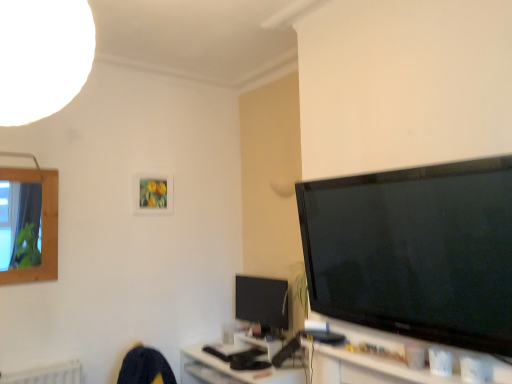
Find the location of a particular element. matte wooden picture frame at upper center is located at coordinates (152, 194).

In order to face matte wooden picture frame at upper center, should I rotate leftwards or rightwards?

Rotate left and turn 13.158 degrees.

The image size is (512, 384). I want to click on wooden frame at left, so click(42, 226).

What is the approximate width of matte black monitor at center?

The width of matte black monitor at center is 3.24 inches.

What do you see at coordinates (234, 370) in the screenshot?
I see `black matte keyboard at lower center` at bounding box center [234, 370].

You are a GUI agent. You are given a task and a screenshot of the screen. Output one action in this format:
    pyautogui.click(x=<x>, y=<y>)
    Task: Click on the white glossy tv cabinet at lower right
    
    Given the screenshot: What is the action you would take?
    pyautogui.click(x=400, y=361)

Where is `tv cabinet above the black matte keyboard at lower center (from the image's perspective)`? tv cabinet above the black matte keyboard at lower center (from the image's perspective) is located at coordinates (400, 361).

Which is in front, white glossy tv cabinet at lower right or black matte keyboard at lower center?

white glossy tv cabinet at lower right.

Considering the sizes of white glossy tv cabinet at lower right and black matte keyboard at lower center in the image, is white glossy tv cabinet at lower right wider or thinner than black matte keyboard at lower center?

Clearly, white glossy tv cabinet at lower right has less width compared to black matte keyboard at lower center.

Considering the positions of objects white glossy tv cabinet at lower right and black matte keyboard at lower center in the image provided, who is more to the left, white glossy tv cabinet at lower right or black matte keyboard at lower center?

black matte keyboard at lower center is more to the left.

Does point (231, 376) come closer to viewer compared to point (243, 311)?

Yes, it is.

Is matte black monitor at center inside black matte keyboard at lower center?

Actually, matte black monitor at center is outside black matte keyboard at lower center.

In terms of height, does black matte keyboard at lower center look taller or shorter compared to matte black monitor at center?

Clearly, black matte keyboard at lower center is shorter compared to matte black monitor at center.

Considering the relative sizes of black matte keyboard at lower center and matte black monitor at center in the image provided, is black matte keyboard at lower center wider than matte black monitor at center?

Yes, black matte keyboard at lower center is wider than matte black monitor at center.

Is black matte keyboard at lower center looking in the opposite direction of matte wooden picture frame at upper center?

No, black matte keyboard at lower center's orientation is not away from matte wooden picture frame at upper center.

Looking at this image, from the image's perspective, which is above, black matte keyboard at lower center or matte wooden picture frame at upper center?

matte wooden picture frame at upper center.

Image resolution: width=512 pixels, height=384 pixels. What are the coordinates of `computer in front of the matte wooden picture frame at upper center` in the screenshot? It's located at (234, 370).

Is black matte keyboard at lower center smaller than matte wooden picture frame at upper center?

No, black matte keyboard at lower center is not smaller than matte wooden picture frame at upper center.

Can you confirm if white glossy tv cabinet at lower right is positioned to the right of matte wooden picture frame at upper center?

Indeed, white glossy tv cabinet at lower right is positioned on the right side of matte wooden picture frame at upper center.

Which is behind, point (344, 355) or point (154, 204)?

The point (154, 204) is behind.

From a real-world perspective, is white glossy tv cabinet at lower right over matte wooden picture frame at upper center?

No, from a real-world perspective, white glossy tv cabinet at lower right is not over matte wooden picture frame at upper center

Considering the sizes of objects white glossy tv cabinet at lower right and matte wooden picture frame at upper center in the image provided, who is thinner, white glossy tv cabinet at lower right or matte wooden picture frame at upper center?

matte wooden picture frame at upper center.

Is black matte keyboard at lower center thinner than wooden frame at left?

Incorrect, the width of black matte keyboard at lower center is not less than that of wooden frame at left.

Is black matte keyboard at lower center completely or partially outside of wooden frame at left?

black matte keyboard at lower center is positioned outside wooden frame at left.

Could you tell me if black matte keyboard at lower center is turned towards wooden frame at left?

No, black matte keyboard at lower center does not turn towards wooden frame at left.

Between point (215, 367) and point (47, 230), which one is positioned behind?

The point (215, 367) is more distant.

Could you tell me if matte black monitor at center is turned towards black matte keyboard at lower center?

No, matte black monitor at center is not oriented towards black matte keyboard at lower center.

Considering the relative sizes of matte black monitor at center and black matte keyboard at lower center in the image provided, is matte black monitor at center shorter than black matte keyboard at lower center?

No, matte black monitor at center is not shorter than black matte keyboard at lower center.

From a real-world perspective, is matte black monitor at center physically located above or below black matte keyboard at lower center?

From a real-world perspective, matte black monitor at center is physically above black matte keyboard at lower center.

How distant is black matte keyboard at lower center from white glossy tv cabinet at lower right?

A distance of 26.46 inches exists between black matte keyboard at lower center and white glossy tv cabinet at lower right.

Between black matte keyboard at lower center and white glossy tv cabinet at lower right, which one appears on the left side from the viewer's perspective?

Positioned to the left is black matte keyboard at lower center.

Does black matte keyboard at lower center have a lesser height compared to white glossy tv cabinet at lower right?

No, black matte keyboard at lower center is not shorter than white glossy tv cabinet at lower right.

Is black matte keyboard at lower center facing towards white glossy tv cabinet at lower right?

No, black matte keyboard at lower center is not oriented towards white glossy tv cabinet at lower right.

Identify the location of tv cabinet on the right of black matte keyboard at lower center. This screenshot has width=512, height=384. (400, 361).

You are a GUI agent. You are given a task and a screenshot of the screen. Output one action in this format:
    pyautogui.click(x=<x>, y=<y>)
    Task: Click on the computer to the left of matte black monitor at center
    The height and width of the screenshot is (384, 512).
    Given the screenshot: What is the action you would take?
    pyautogui.click(x=234, y=370)

In the scene shown: From the image, which object appears to be farther from wooden frame at left, white glossy tv cabinet at lower right or black matte keyboard at lower center?

Based on the image, white glossy tv cabinet at lower right appears to be further to wooden frame at left.

From the image, which object appears to be farther from matte black monitor at center, matte wooden picture frame at upper center or black matte keyboard at lower center?

Among the two, matte wooden picture frame at upper center is located further to matte black monitor at center.

From the image, which object appears to be farther from white glossy tv cabinet at lower right, matte wooden picture frame at upper center or black matte keyboard at lower center?

Based on the image, matte wooden picture frame at upper center appears to be further to white glossy tv cabinet at lower right.

When comparing their distances from matte wooden picture frame at upper center, does white glossy tv cabinet at lower right or wooden frame at left seem closer?

The object closer to matte wooden picture frame at upper center is wooden frame at left.

Looking at the image, which one is located closer to white glossy tv cabinet at lower right, matte wooden picture frame at upper center or matte black monitor at center?

matte black monitor at center.

Which object lies further to the anchor point matte wooden picture frame at upper center, matte black monitor at center or wooden frame at left?

Among the two, matte black monitor at center is located further to matte wooden picture frame at upper center.

Estimate the real-world distances between objects in this image. Which object is closer to wooden frame at left, matte wooden picture frame at upper center or matte black monitor at center?

matte wooden picture frame at upper center is positioned closer to the anchor wooden frame at left.

Based on their spatial positions, is white glossy tv cabinet at lower right or matte black monitor at center further from black matte keyboard at lower center?

white glossy tv cabinet at lower right.

Identify the location of window between matte wooden picture frame at upper center and black matte keyboard at lower center from top to bottom. (42, 226).

Identify the location of television between matte wooden picture frame at upper center and black matte keyboard at lower center from top to bottom. (261, 301).

Find the location of `television situated between wooden frame at left and white glossy tv cabinet at lower right from left to right`. television situated between wooden frame at left and white glossy tv cabinet at lower right from left to right is located at coordinates (261, 301).

Locate an element on the screen. This screenshot has height=384, width=512. picture frame situated between wooden frame at left and white glossy tv cabinet at lower right from left to right is located at coordinates (152, 194).